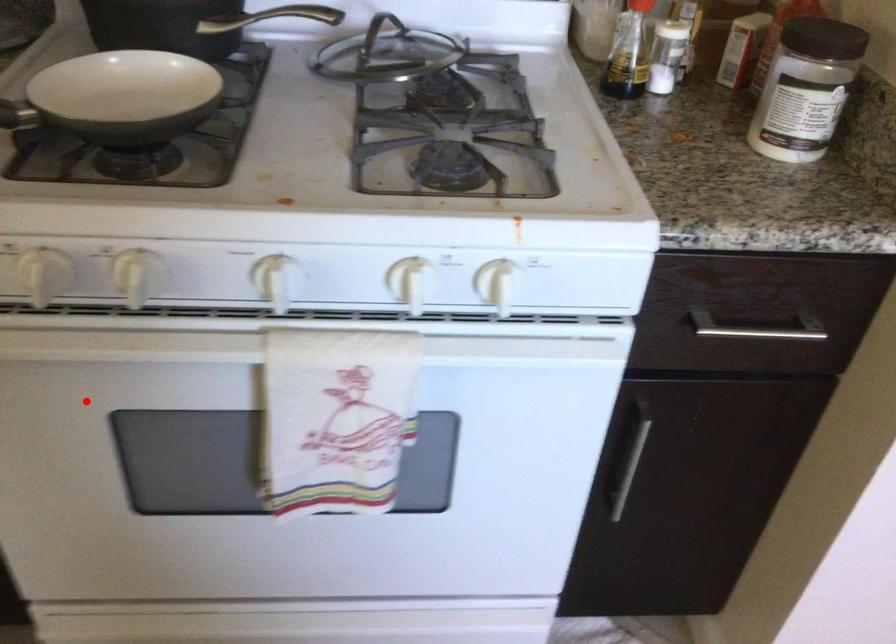
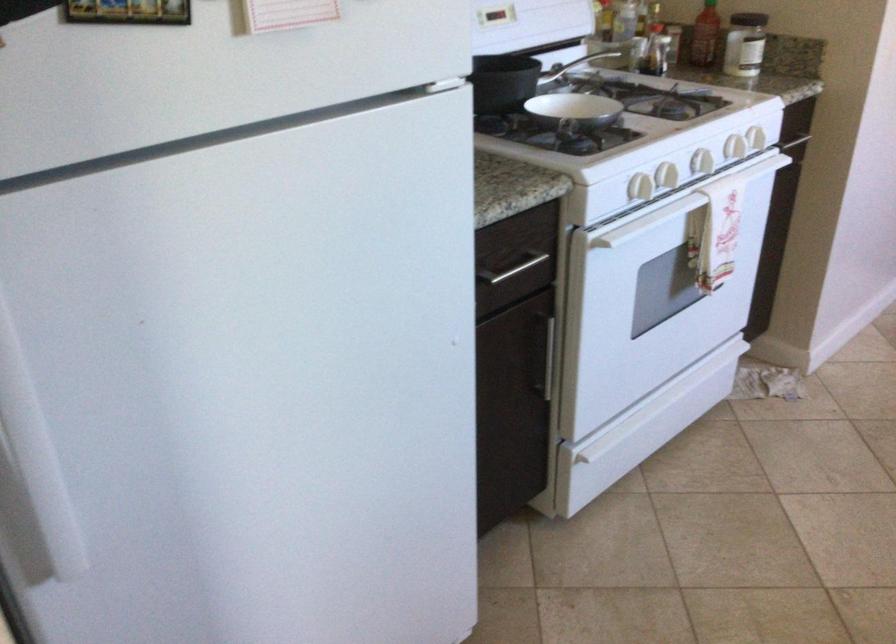
Question: I am providing you with two images of the same scene from different viewpoints. A red point is marked on the first image. Is the red point's position out of view in image 2?

Choices:
 (A) Yes
 (B) No

Answer: (B)